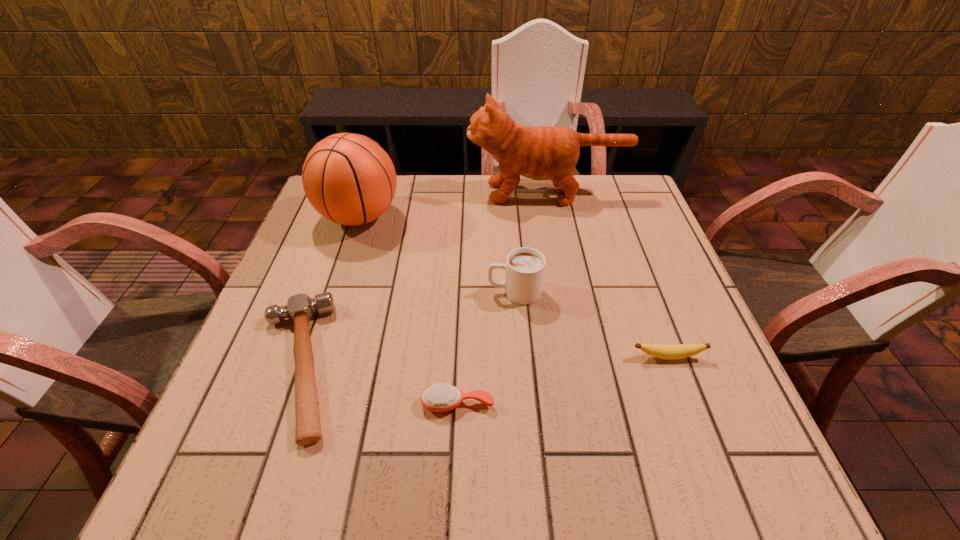
At what (x,y) coordinates should I click in order to perform the action: click on vacant position located on the side with the handle of the cappuccino. Please return your answer as a coordinate pair (x, y). Looking at the image, I should click on point(430,292).

This screenshot has width=960, height=540. In order to click on free region located 0.320m on the side with the handle of the cappuccino in this screenshot , I will do click(x=346, y=292).

Locate an element on the screen. The height and width of the screenshot is (540, 960). free space located on the side with the handle of the cappuccino is located at coordinates (390, 292).

You are a GUI agent. You are given a task and a screenshot of the screen. Output one action in this format:
    pyautogui.click(x=<x>, y=<y>)
    Task: Click on the vacant space located on the back of the hammer
    
    Given the screenshot: What is the action you would take?
    pyautogui.click(x=340, y=244)

This screenshot has height=540, width=960. What are the coordinates of `vacant point located 0.260m on the back of the banana` in the screenshot? It's located at (634, 264).

This screenshot has height=540, width=960. In order to click on free region located on the back of the hairbrush in this screenshot , I will do `click(462, 303)`.

The image size is (960, 540). What are the coordinates of `cat that is at the far edge` in the screenshot? It's located at (540, 153).

Where is `basketball that is positioned at the far edge`? The height and width of the screenshot is (540, 960). basketball that is positioned at the far edge is located at coordinates (348, 178).

Where is `object present at the near edge`? object present at the near edge is located at coordinates (300, 308).

Find the location of a particular element. This screenshot has height=540, width=960. basketball that is at the left edge is located at coordinates (348, 178).